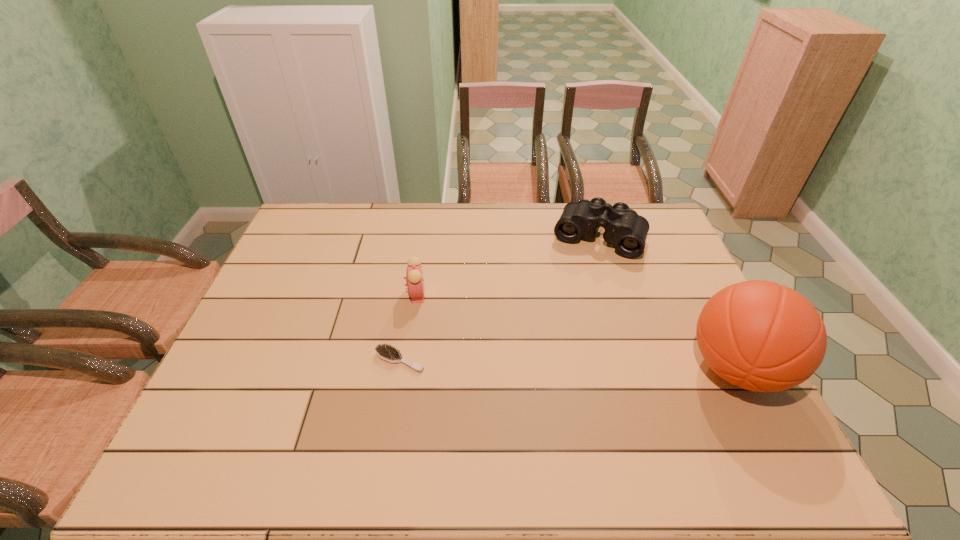
Locate an element on the screen. unoccupied area between the tallest object and the farthest object is located at coordinates (667, 303).

What are the coordinates of `free space that is in between the shortest object and the tallest object` in the screenshot? It's located at pyautogui.click(x=568, y=364).

Identify the location of free area in between the farthest object and the basketball. The height and width of the screenshot is (540, 960). point(667,303).

Identify which object is the second closest to the shortest object. Please provide its 2D coordinates. Your answer should be formatted as a tuple, i.e. [(x, y)], where the tuple contains the x and y coordinates of a point satisfying the conditions above.

[(624, 228)]

Choose which object is the second nearest neighbor to the binoculars. Please provide its 2D coordinates. Your answer should be formatted as a tuple, i.e. [(x, y)], where the tuple contains the x and y coordinates of a point satisfying the conditions above.

[(414, 276)]

Locate an element on the screen. vacant space that satisfies the following two spatial constraints: 1. on the back side of the binoculars; 2. on the left side of the shortest object is located at coordinates (420, 237).

Locate an element on the screen. vacant position in the image that satisfies the following two spatial constraints: 1. on the back side of the alarm clock; 2. on the right side of the shortest object is located at coordinates (411, 294).